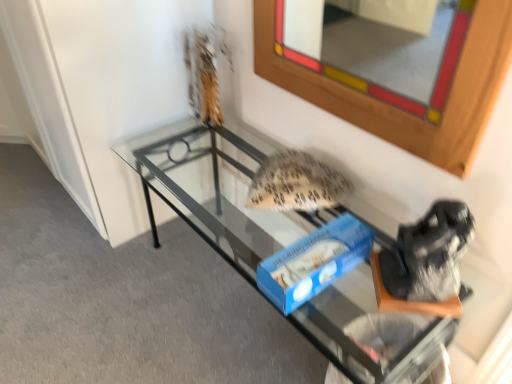
Question: Is transparent glass table at center inside the boundaries of wooden frame at upper center, or outside?

Choices:
 (A) outside
 (B) inside

Answer: (A)

Question: Is point (315, 296) closer or farther from the camera than point (346, 11)?

Choices:
 (A) farther
 (B) closer

Answer: (B)

Question: From the image's perspective, relative to wooden frame at upper center, is transparent glass table at center above or below?

Choices:
 (A) below
 (B) above

Answer: (A)

Question: In terms of size, does wooden frame at upper center appear bigger or smaller than transparent glass table at center?

Choices:
 (A) small
 (B) big

Answer: (A)

Question: From the image's perspective, is wooden frame at upper center located above or below transparent glass table at center?

Choices:
 (A) below
 (B) above

Answer: (B)

Question: Would you say wooden frame at upper center is to the left or to the right of transparent glass table at center in the picture?

Choices:
 (A) left
 (B) right

Answer: (B)

Question: From their relative heights in the image, would you say wooden frame at upper center is taller or shorter than transparent glass table at center?

Choices:
 (A) short
 (B) tall

Answer: (B)